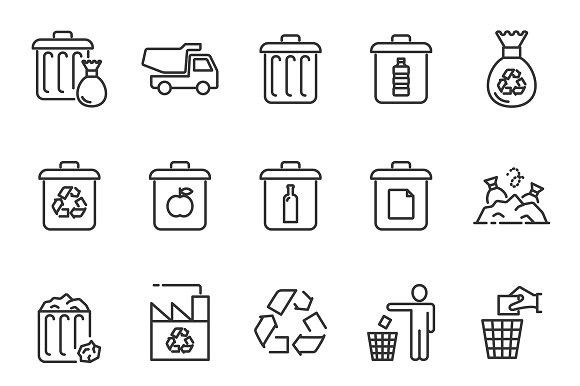
Find the location of a particular element. waste can icons is located at coordinates (68, 330), (382, 346), (514, 327), (403, 207), (285, 195), (187, 191), (84, 208), (286, 58), (398, 73), (53, 65).